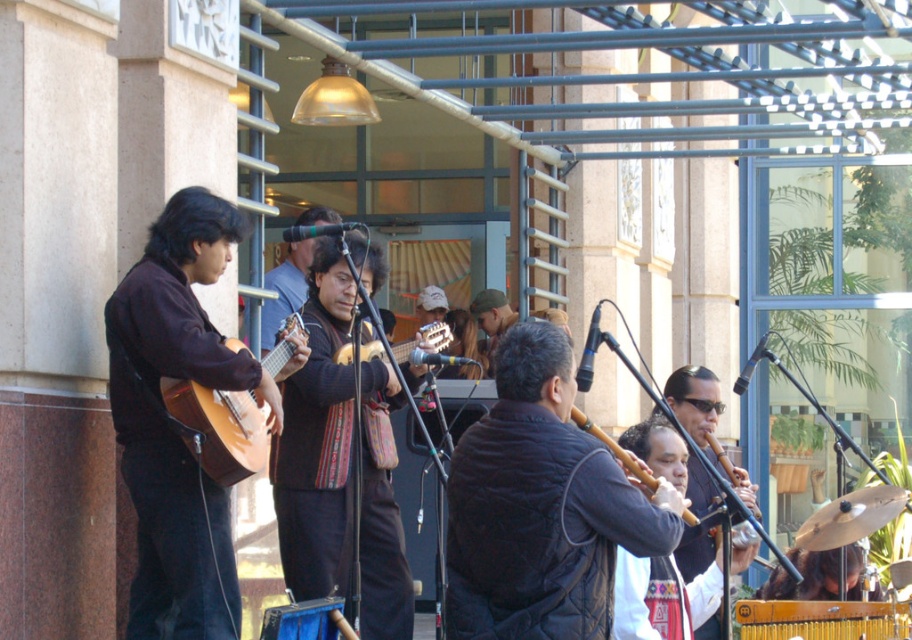
Between point (289, 541) and point (240, 413), which one is positioned in front?

Point (240, 413)

Where is `knitted sweater at center`? This screenshot has width=912, height=640. knitted sweater at center is located at coordinates (340, 465).

Does point (325, 310) come behind point (224, 416)?

Yes, point (325, 310) is behind point (224, 416).

At what (x,y) coordinates should I click in order to perform the action: click on knitted sweater at center. Please return your answer as a coordinate pair (x, y). The height and width of the screenshot is (640, 912). Looking at the image, I should click on (x=340, y=465).

What do you see at coordinates (541, 506) in the screenshot?
I see `dark brown leather jacket at center` at bounding box center [541, 506].

This screenshot has height=640, width=912. Find the location of `dark brown leather jacket at center`. dark brown leather jacket at center is located at coordinates (541, 506).

Can you confirm if matte brown guitar at left is positioned below knitted sweater at center?

Actually, matte brown guitar at left is above knitted sweater at center.

Is point (149, 385) positioned behind point (309, 332)?

No, (149, 385) is closer to viewer.

Where is `matte brown guitar at left`? matte brown guitar at left is located at coordinates (172, 422).